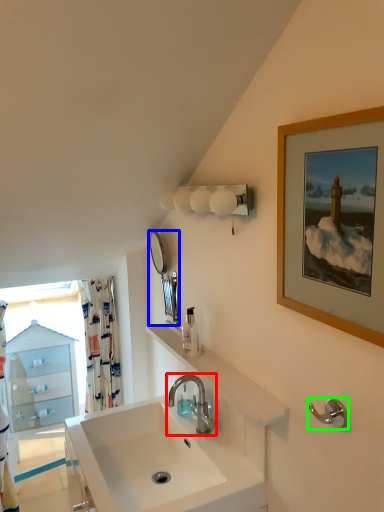
Question: Which object is the closest to the tap (highlighted by a red box)? Choose among these: mirror (highlighted by a blue box) or towel bar (highlighted by a green box).

Choices:
 (A) mirror
 (B) towel bar

Answer: (A)